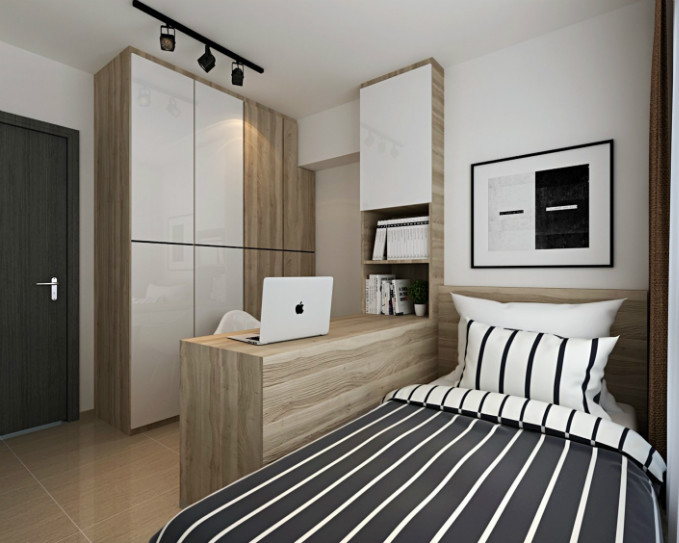
I want to click on floor, so click(144, 467).